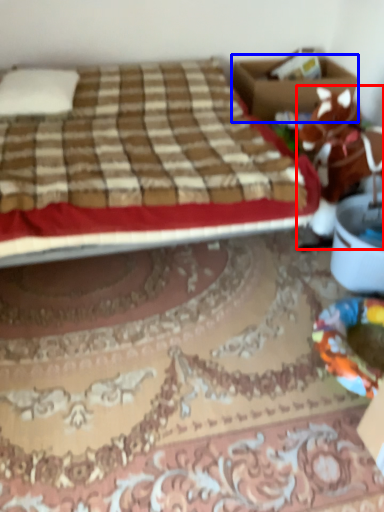
Question: Which of the following is the closest to the observer, animal (highlighted by a red box) or box (highlighted by a blue box)?

Choices:
 (A) animal
 (B) box

Answer: (A)